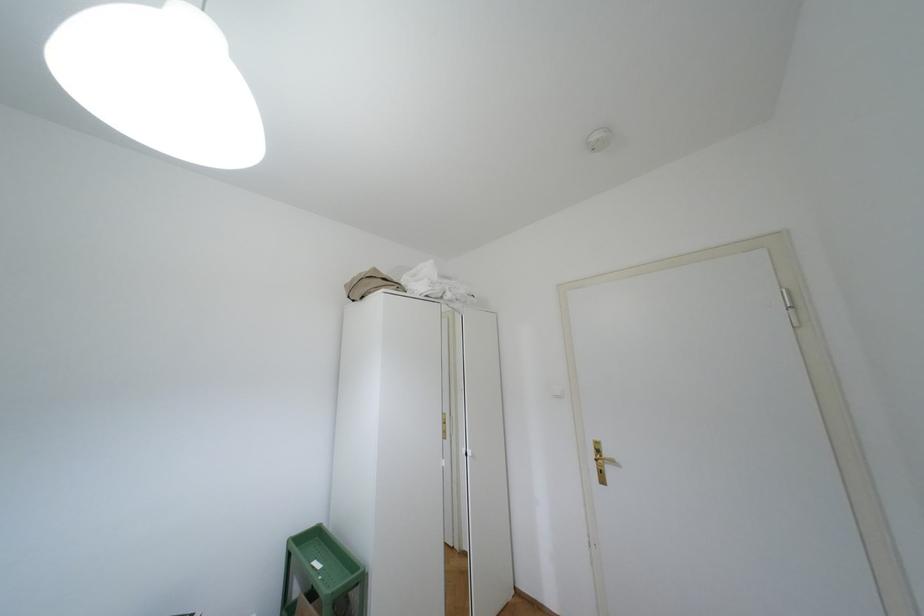
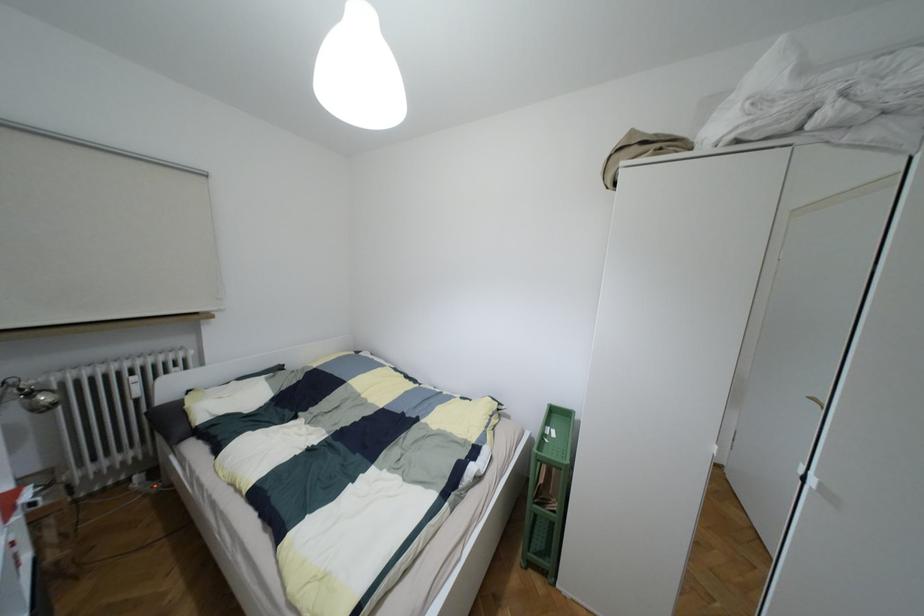
Question: The camera is either moving clockwise (left) or counter-clockwise (right) around the object. The first image is from the beginning of the video and the second image is from the end. Is the camera moving left or right when shooting the video?

Choices:
 (A) Left
 (B) Right

Answer: (B)